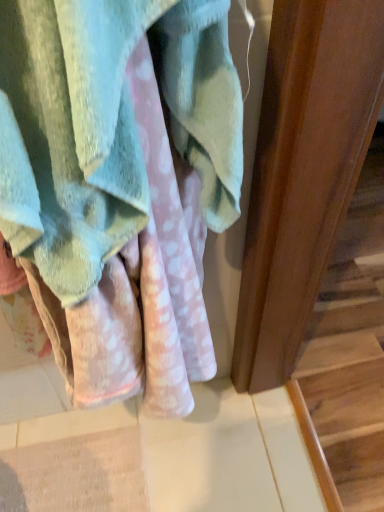
Question: From the image's perspective, is wooden at right below soft pink towel at center?

Choices:
 (A) yes
 (B) no

Answer: (A)

Question: Is wooden at right aimed at soft pink towel at center?

Choices:
 (A) yes
 (B) no

Answer: (B)

Question: From a real-world perspective, is wooden at right physically below soft pink towel at center?

Choices:
 (A) no
 (B) yes

Answer: (B)

Question: Does wooden at right appear on the left side of soft pink towel at center?

Choices:
 (A) no
 (B) yes

Answer: (A)

Question: Is wooden at right in contact with soft pink towel at center?

Choices:
 (A) no
 (B) yes

Answer: (A)

Question: Is wooden at right taller than soft pink towel at center?

Choices:
 (A) yes
 (B) no

Answer: (B)

Question: Does soft pink towel at center contain wooden at right?

Choices:
 (A) yes
 (B) no

Answer: (B)

Question: Is soft pink towel at center at the right side of wooden at right?

Choices:
 (A) yes
 (B) no

Answer: (B)

Question: Can you confirm if soft pink towel at center is smaller than wooden at right?

Choices:
 (A) no
 (B) yes

Answer: (B)

Question: Is soft pink towel at center closer to camera compared to wooden at right?

Choices:
 (A) no
 (B) yes

Answer: (B)

Question: Is soft pink towel at center not near wooden at right?

Choices:
 (A) no
 (B) yes

Answer: (B)

Question: Is soft pink towel at center facing away from wooden at right?

Choices:
 (A) yes
 (B) no

Answer: (B)

Question: Would you say wooden at right is to the left or to the right of soft pink towel at center in the picture?

Choices:
 (A) left
 (B) right

Answer: (B)